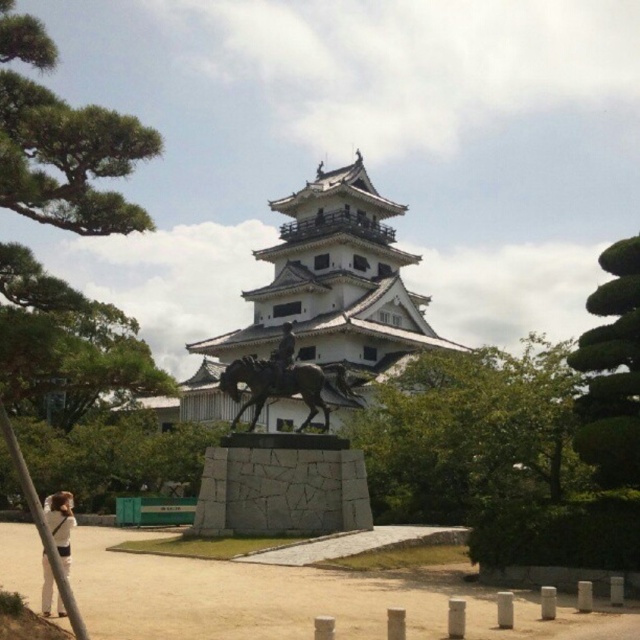
You are planning to take a photo of the white stone tower at center and the green leafy tree at lower left. Which object should you focus on first if you want to capture both in the frame without moving the camera?

The white stone tower at center is wider than the green leafy tree at lower left, so you should focus on the white stone tower at center first to ensure it fits properly in the frame.

In the scene shown: You are an architect designing a new garden layout. You need to place a decorative element that requires a space wider than the white fabric at lower left. Can the white stone tower at center accommodate this requirement based on the scene?

The white stone tower at center has a width larger than the white fabric at lower left, so it can accommodate the decorative element requiring a space wider than the white fabric at lower left.

You are a visitor standing in front of the white stone tower at center and the white fabric at lower left. Which object is located higher up in the scene?

The white stone tower at center is positioned over the white fabric at lower left, so it is higher up in the scene.